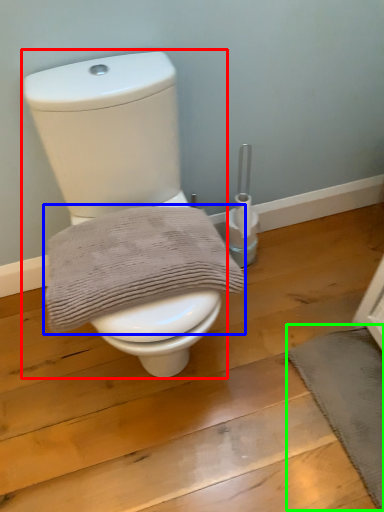
Question: Considering the real-world distances, which object is farthest from toilet (highlighted by a red box)? bath towel (highlighted by a blue box) or bath mat (highlighted by a green box)?

Choices:
 (A) bath towel
 (B) bath mat

Answer: (B)